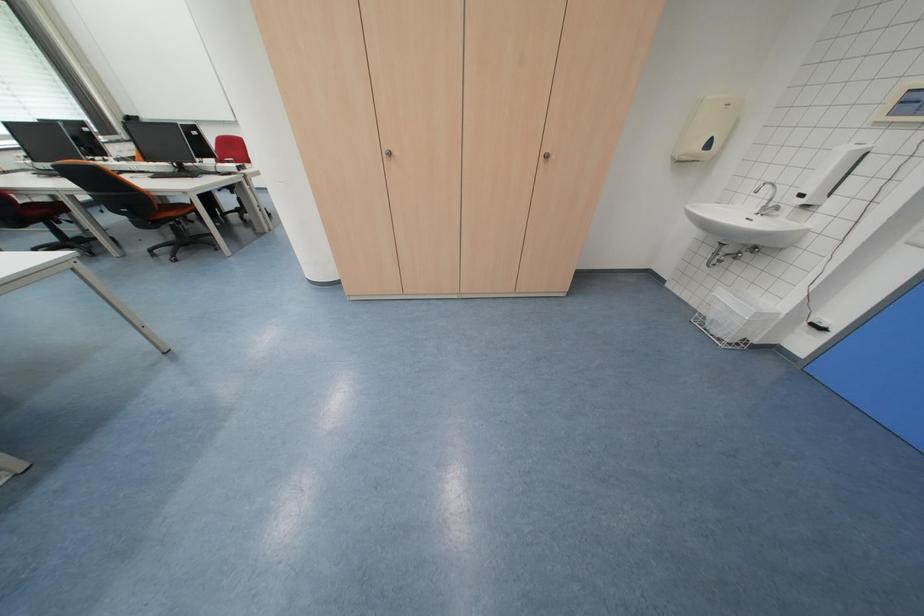
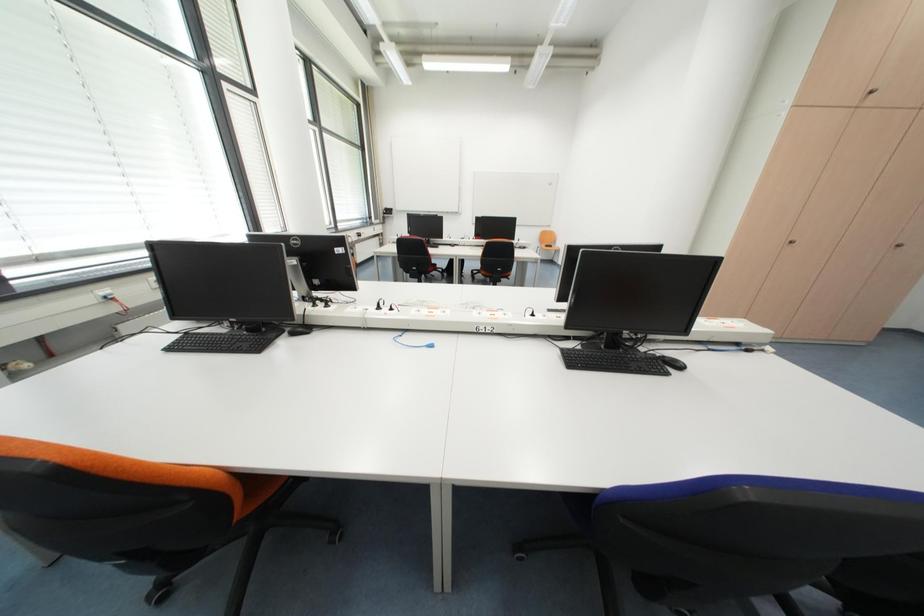
Question: In a continuous first-person perspective shot, in which direction is the camera moving?

Choices:
 (A) Left
 (B) Right
 (C) Forward
 (D) Backward

Answer: (A)